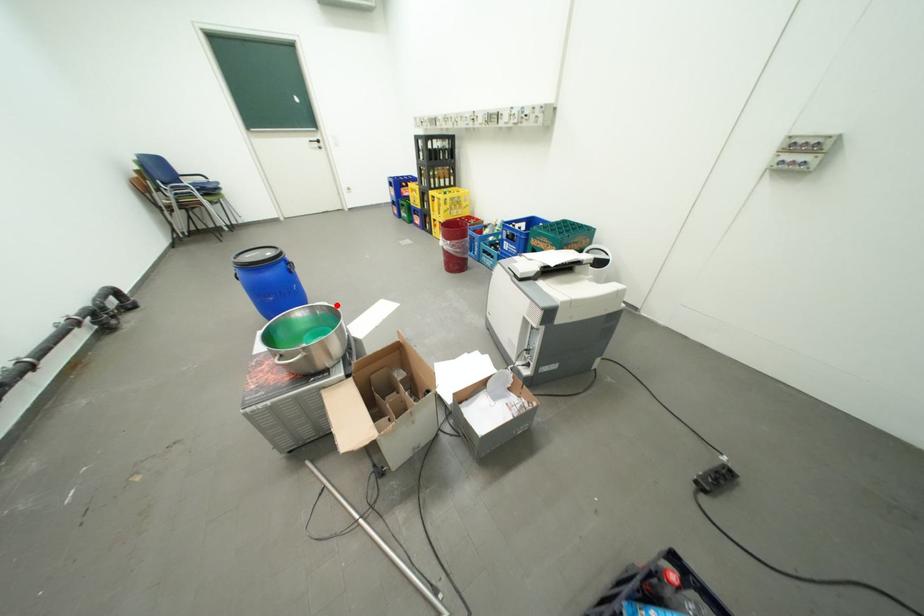
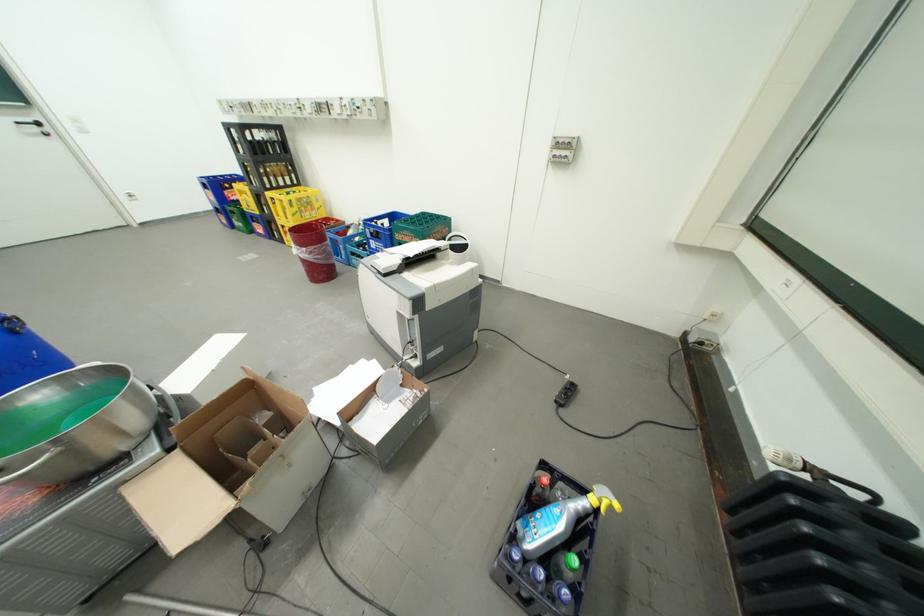
Question: I am providing you with two images of the same scene from different viewpoints. A red point is marked on the first image. Can you still see the location of the red point in image 2?

Choices:
 (A) Yes
 (B) No

Answer: (A)